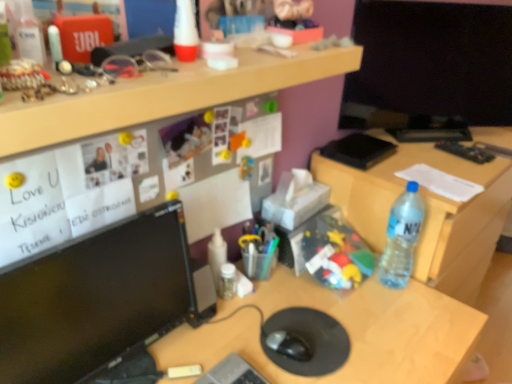
Locate an element on the screen. This screenshot has height=384, width=512. vacant region above black rubber mousepad at center (from a real-world perspective) is located at coordinates (305, 331).